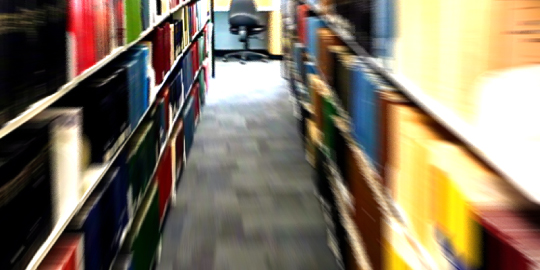
Find the location of a particular element. This screenshot has height=270, width=540. shelves is located at coordinates (171, 68), (157, 28), (174, 125).